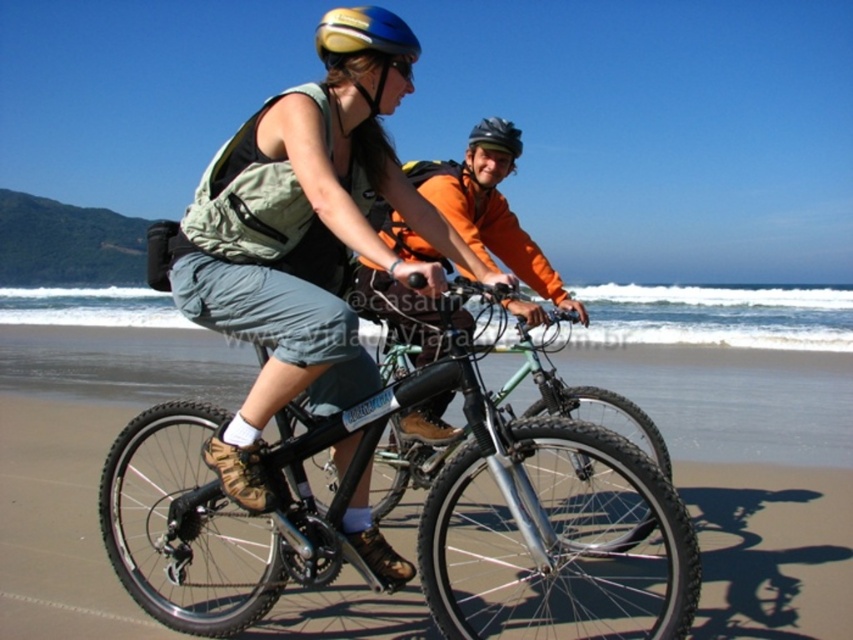
You are a photographer trying to capture a photo of the two cyclists. You notice the orange fleece jacket at center and the yellow matte bicycle helmet at upper center in your viewfinder. Which object should you focus on first if you want to prioritize the one closer to the camera?

The yellow matte bicycle helmet at upper center is closer to the camera than the orange fleece jacket at center, so you should focus on the yellow matte bicycle helmet at upper center first.

In the scene shown: You are standing on the beach and want to take a photo of the black matte bicycle at center. If your camera can focus on objects up to 6 feet away, will it be able to capture the bicycle clearly?

The black matte bicycle at center is 5.58 feet away from viewer, so yes, the camera can focus on it since the distance is within the 6 feet limit.

You are a photographer standing on the beach. You want to take a photo of the black matte bicycle at center and the yellow matte bicycle helmet at upper center. Which object should you focus on first to ensure both are in sharp focus?

The black matte bicycle at center is closer to the viewer than the yellow matte bicycle helmet at upper center. Therefore, focusing on the black matte bicycle at center will ensure both objects are in sharp focus since it is the closer one.